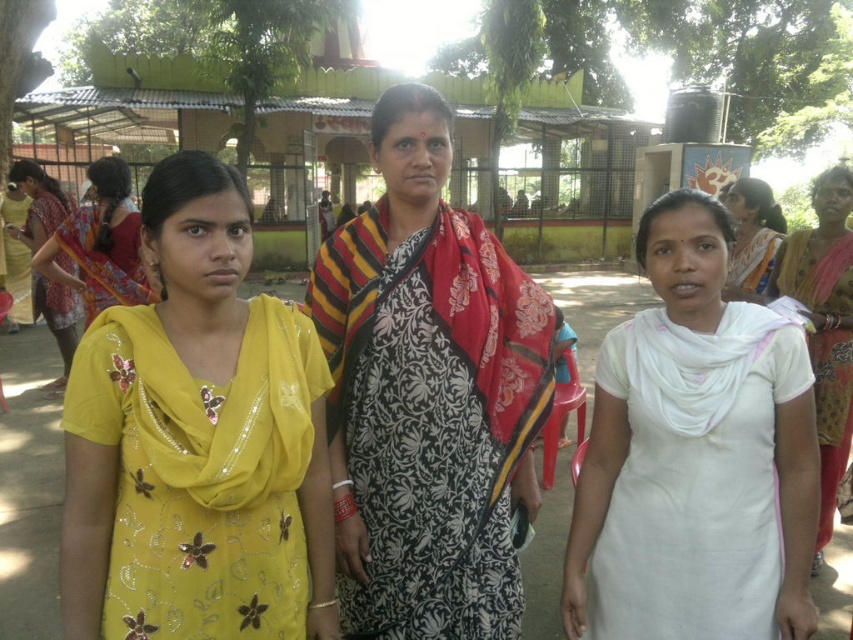
Question: Is white cotton dress at center positioned behind matte pink saree at upper right?

Choices:
 (A) no
 (B) yes

Answer: (A)

Question: Is brown textured saree at right wider than matte pink saree at upper right?

Choices:
 (A) no
 (B) yes

Answer: (A)

Question: Does black printed saree at center appear on the left side of matte pink saree at upper right?

Choices:
 (A) yes
 (B) no

Answer: (A)

Question: Which of the following is the farthest from the observer?

Choices:
 (A) (39, 168)
 (B) (694, 320)

Answer: (A)

Question: Among these objects, which one is farthest from the camera?

Choices:
 (A) yellow floral dress at left
 (B) brown textured saree at right

Answer: (B)

Question: Which of these objects is positioned farthest from the black printed saree at center?

Choices:
 (A) white cotton dress at center
 (B) brown textured saree at right
 (C) yellow fabric saree at left
 (D) yellow floral dress at left

Answer: (C)